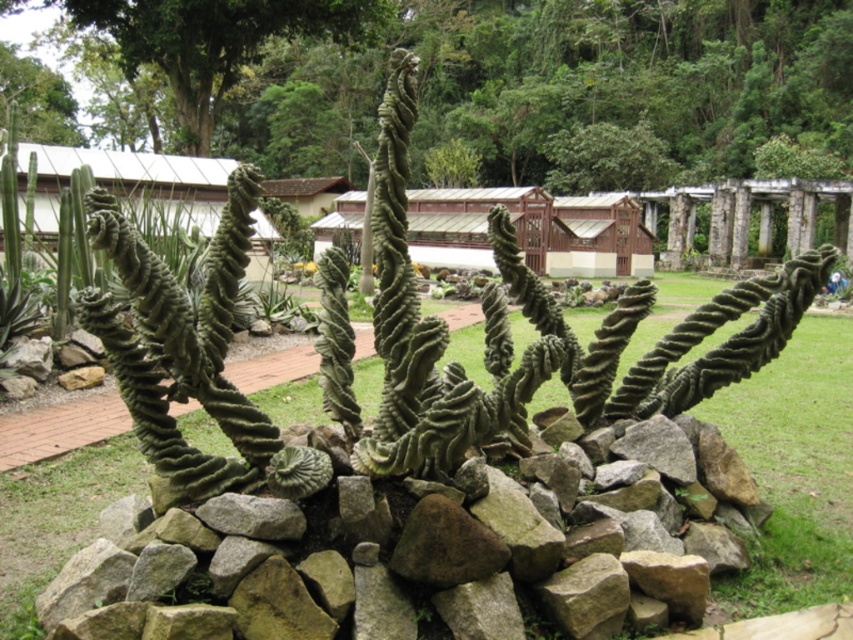
Question: Among these objects, which one is farthest from the camera?

Choices:
 (A) green leafy tree at upper left
 (B) green textured tree at upper center

Answer: (B)

Question: Does green textured tree at upper center have a smaller size compared to green leafy tree at upper left?

Choices:
 (A) yes
 (B) no

Answer: (B)

Question: Which object is farther from the camera taking this photo?

Choices:
 (A) green textured tree at upper center
 (B) green leafy tree at upper left
 (C) green grass at center

Answer: (A)

Question: Is green textured tree at upper center below green leafy tree at upper left?

Choices:
 (A) no
 (B) yes

Answer: (A)

Question: Does green textured tree at upper center have a smaller size compared to green leafy tree at upper left?

Choices:
 (A) yes
 (B) no

Answer: (B)

Question: Estimate the real-world distances between objects in this image. Which object is farther from the green grass at center?

Choices:
 (A) green leafy tree at upper left
 (B) green textured tree at upper center

Answer: (B)